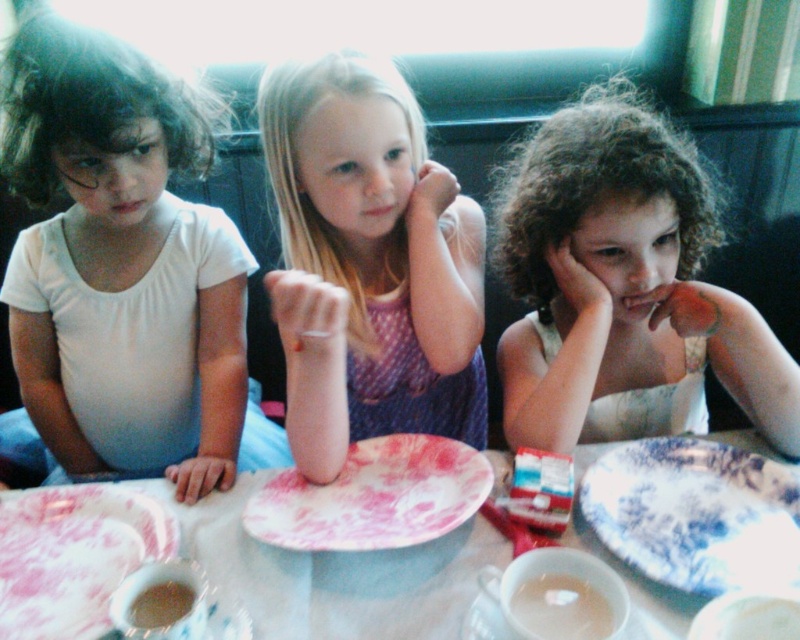
Question: Does white matte shirt at left appear over curly hair at center?

Choices:
 (A) yes
 (B) no

Answer: (B)

Question: Considering the real-world distances, which object is farthest from the floral porcelain plate at center?

Choices:
 (A) pink fabric dress at center
 (B) blue porcelain plate at lower right
 (C) white matte shirt at left
 (D) translucent glass cup at lower center

Answer: (C)

Question: Is floral porcelain plate at center bigger than translucent glass cup at lower center?

Choices:
 (A) yes
 (B) no

Answer: (A)

Question: Is white paper plate at center to the right of porcelain plate at lower left from the viewer's perspective?

Choices:
 (A) no
 (B) yes

Answer: (B)

Question: Which object is closer to the camera taking this photo?

Choices:
 (A) white matte shirt at left
 (B) translucent glass cup at lower center
 (C) floral porcelain plate at center

Answer: (B)

Question: Which object appears closest to the camera in this image?

Choices:
 (A) brown crumbly cake at lower left
 (B) floral porcelain plate at center
 (C) white paper plate at center

Answer: (A)